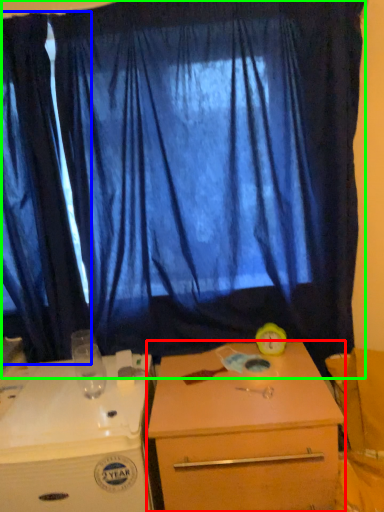
Question: Considering the real-world distances, which object is farthest from desk (highlighted by a red box)? curtain (highlighted by a blue box) or curtain (highlighted by a green box)?

Choices:
 (A) curtain
 (B) curtain

Answer: (A)